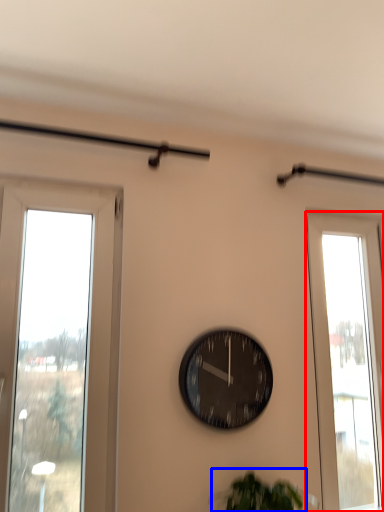
Question: Which object appears closest to the camera in this image, window (highlighted by a red box) or plant (highlighted by a blue box)?

Choices:
 (A) window
 (B) plant

Answer: (B)